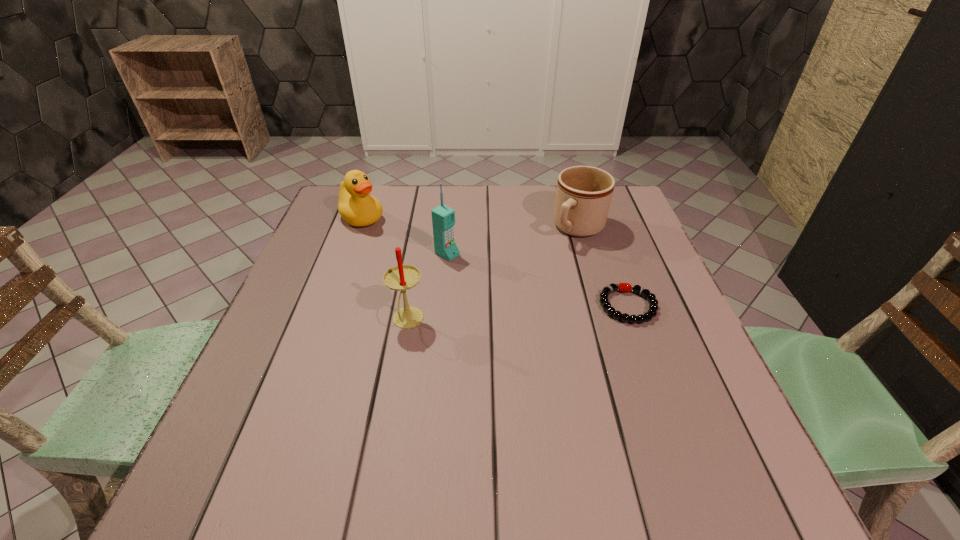
You are a GUI agent. You are given a task and a screenshot of the screen. Output one action in this format:
    pyautogui.click(x=<x>, y=<y>)
    Task: Click on the mug present at the right edge
    
    Given the screenshot: What is the action you would take?
    pyautogui.click(x=583, y=195)

Where is `object that is positioned at the far left corner`? object that is positioned at the far left corner is located at coordinates (356, 206).

What are the coordinates of `object present at the far right corner` in the screenshot? It's located at (583, 195).

What are the coordinates of `free space at the far edge` in the screenshot? It's located at (487, 228).

Where is `vacant region at the near edge`? Image resolution: width=960 pixels, height=540 pixels. vacant region at the near edge is located at coordinates (428, 422).

Where is `vacant space at the left edge of the desktop`? vacant space at the left edge of the desktop is located at coordinates (353, 296).

Identify the location of vacant space at the right edge of the desktop. [656, 253].

Where is `free space at the near left corner of the desktop`? This screenshot has height=540, width=960. free space at the near left corner of the desktop is located at coordinates (231, 404).

At what (x,y) coordinates should I click in order to perform the action: click on free space between the fourth object from right to left and the shortest object. Please return your answer as a coordinate pair (x, y). This screenshot has width=960, height=540. Looking at the image, I should click on (517, 313).

Locate an element on the screen. free space between the third object from left to right and the second object from left to right is located at coordinates (427, 288).